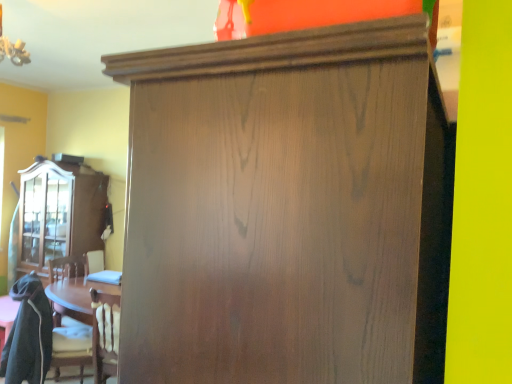
This screenshot has height=384, width=512. What do you see at coordinates (287, 209) in the screenshot?
I see `satin wood cupboard at center` at bounding box center [287, 209].

Find the location of `satin wood cupboard at center`. satin wood cupboard at center is located at coordinates (287, 209).

Find the location of `matte wood cabinet at left`. matte wood cabinet at left is located at coordinates (56, 215).

The image size is (512, 384). What are the coordinates of `satin wood cupboard at center` in the screenshot? It's located at (287, 209).

Find the location of a particular element. The height and width of the screenshot is (384, 512). cupboard located above the wooden swivel chair at lower left (from the image's perspective) is located at coordinates (287, 209).

Considering the positions of objects wooden swivel chair at lower left and satin wood cupboard at center in the image provided, who is more to the right, wooden swivel chair at lower left or satin wood cupboard at center?

satin wood cupboard at center is more to the right.

Does wooden swivel chair at lower left have a larger size compared to satin wood cupboard at center?

Actually, wooden swivel chair at lower left might be smaller than satin wood cupboard at center.

Is satin wood cupboard at center surrounded by matte wood cabinet at left?

Actually, satin wood cupboard at center is outside matte wood cabinet at left.

Identify the location of cabinetry above the satin wood cupboard at center (from a real-world perspective). (56, 215).

In terms of size, does matte wood cabinet at left appear bigger or smaller than satin wood cupboard at center?

Clearly, matte wood cabinet at left is smaller in size than satin wood cupboard at center.

Which object is closer to the camera taking this photo, matte wood cabinet at left or satin wood cupboard at center?

satin wood cupboard at center is in front.

Is satin wood cupboard at center aimed at matte wood cabinet at left?

Yes, satin wood cupboard at center is aimed at matte wood cabinet at left.

Considering the relative positions of satin wood cupboard at center and matte wood cabinet at left in the image provided, is satin wood cupboard at center to the left of matte wood cabinet at left from the viewer's perspective?

No, satin wood cupboard at center is not to the left of matte wood cabinet at left.

Does satin wood cupboard at center contain matte wood cabinet at left?

No, matte wood cabinet at left is not surrounded by satin wood cupboard at center.

Which of these two, satin wood cupboard at center or matte wood cabinet at left, is thinner?

Thinner between the two is matte wood cabinet at left.

Does satin wood cupboard at center have a smaller size compared to wooden swivel chair at lower left?

Actually, satin wood cupboard at center might be larger than wooden swivel chair at lower left.

Is satin wood cupboard at center in contact with wooden swivel chair at lower left?

No, satin wood cupboard at center is not making contact with wooden swivel chair at lower left.

From the image's perspective, which object appears higher, satin wood cupboard at center or wooden swivel chair at lower left?

satin wood cupboard at center.

In order to click on swivel chair that is under the matte wood cabinet at left (from a real-world perspective) in this screenshot , I will do (x=36, y=335).

Is matte wood cabinet at left to the left or to the right of wooden swivel chair at lower left in the image?

matte wood cabinet at left is to the left of wooden swivel chair at lower left.

Is matte wood cabinet at left surrounding wooden swivel chair at lower left?

No.

From a real-world perspective, who is located higher, wooden swivel chair at lower left or matte wood cabinet at left?

matte wood cabinet at left, from a real-world perspective.

Is point (55, 334) in front of point (54, 241)?

Yes, point (55, 334) is in front of point (54, 241).

Is matte wood cabinet at left inside wooden swivel chair at lower left?

Definitely not — matte wood cabinet at left is not inside wooden swivel chair at lower left.

From the image's perspective, is wooden swivel chair at lower left over matte wood cabinet at left?

Actually, wooden swivel chair at lower left appears below matte wood cabinet at left in the image.

At what (x,y) coordinates should I click in order to perform the action: click on swivel chair located underneath the satin wood cupboard at center (from a real-world perspective). Please return your answer as a coordinate pair (x, y). Looking at the image, I should click on (36, 335).

Image resolution: width=512 pixels, height=384 pixels. Identify the location of cabinetry lying above the satin wood cupboard at center (from the image's perspective). (56, 215).

Estimate the real-world distances between objects in this image. Which object is closer to wooden swivel chair at lower left, satin wood cupboard at center or matte wood cabinet at left?

matte wood cabinet at left.

Estimate the real-world distances between objects in this image. Which object is further from matte wood cabinet at left, satin wood cupboard at center or wooden swivel chair at lower left?

satin wood cupboard at center lies further to matte wood cabinet at left than the other object.

Based on their spatial positions, is wooden swivel chair at lower left or matte wood cabinet at left further from satin wood cupboard at center?

matte wood cabinet at left.

Estimate the real-world distances between objects in this image. Which object is closer to matte wood cabinet at left, wooden swivel chair at lower left or satin wood cupboard at center?

Among the two, wooden swivel chair at lower left is located nearer to matte wood cabinet at left.

When comparing their distances from wooden swivel chair at lower left, does matte wood cabinet at left or satin wood cupboard at center seem further?

Based on the image, satin wood cupboard at center appears to be further to wooden swivel chair at lower left.

Based on their spatial positions, is matte wood cabinet at left or wooden swivel chair at lower left further from satin wood cupboard at center?

The object further to satin wood cupboard at center is matte wood cabinet at left.

Identify the location of swivel chair between satin wood cupboard at center and matte wood cabinet at left from front to back. (36, 335).